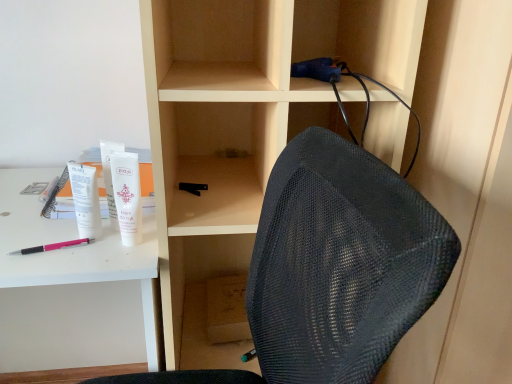
Find the location of `free space behind pink plastic pen at lower left`. free space behind pink plastic pen at lower left is located at coordinates (55, 216).